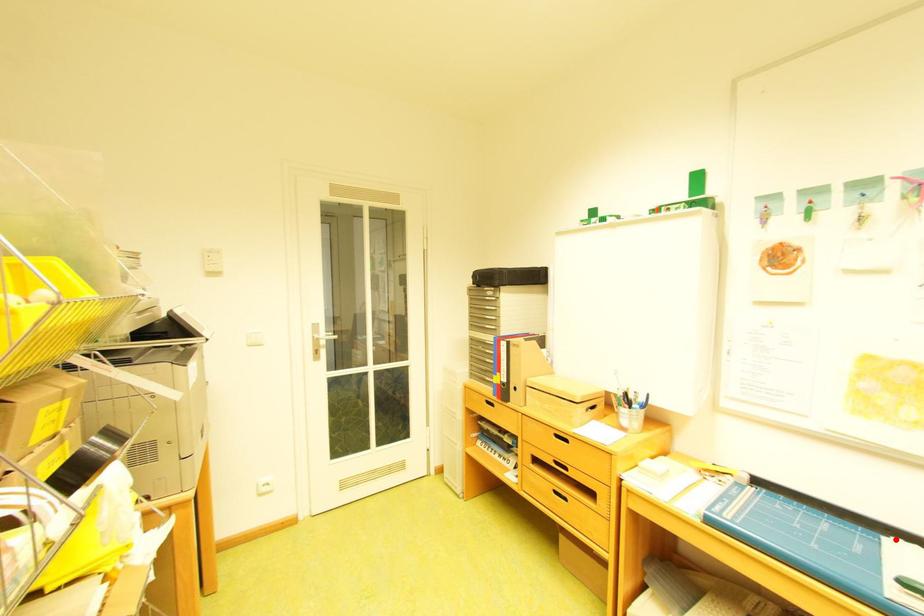
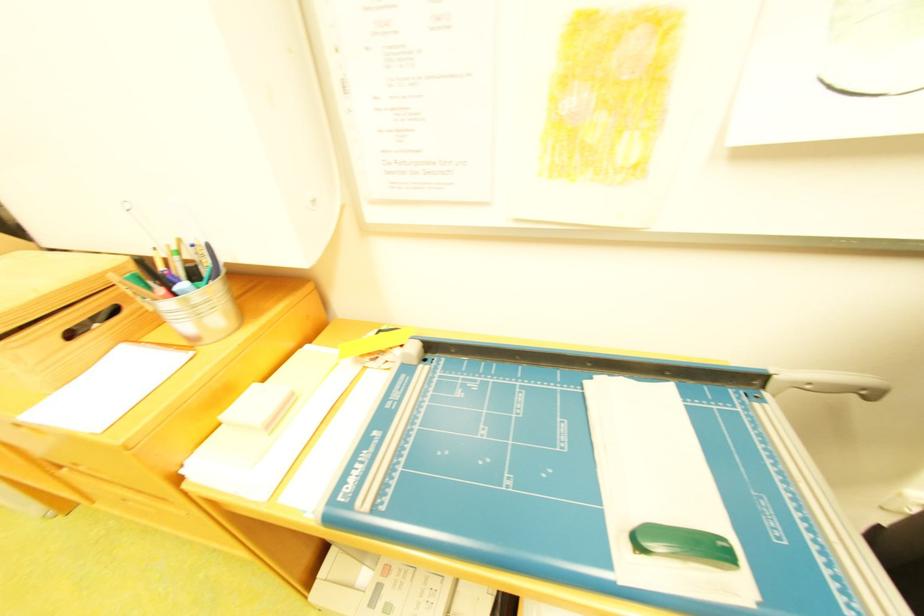
Locate, in the second image, the point that corresponds to the highlighted location in the first image.

(598, 384)